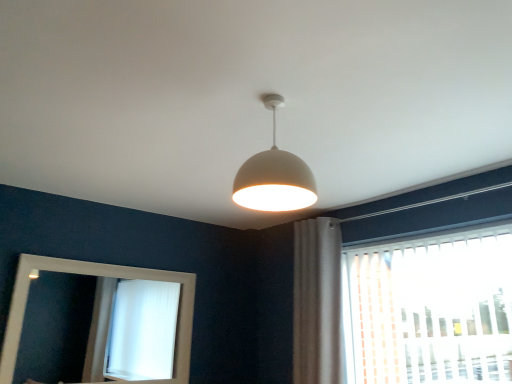
Question: Is white matte/porcelain lampshade at center inside white plastic blinds at right?

Choices:
 (A) no
 (B) yes

Answer: (A)

Question: Is white plastic blinds at right closer to camera compared to white matte/porcelain lampshade at center?

Choices:
 (A) no
 (B) yes

Answer: (A)

Question: Considering the relative sizes of white plastic blinds at right and white matte/porcelain lampshade at center in the image provided, is white plastic blinds at right thinner than white matte/porcelain lampshade at center?

Choices:
 (A) no
 (B) yes

Answer: (B)

Question: Is white plastic blinds at right far away from white matte/porcelain lampshade at center?

Choices:
 (A) yes
 (B) no

Answer: (A)

Question: Is white plastic blinds at right directly adjacent to white matte/porcelain lampshade at center?

Choices:
 (A) yes
 (B) no

Answer: (B)

Question: Can you confirm if white plastic blinds at right is bigger than white matte/porcelain lampshade at center?

Choices:
 (A) no
 (B) yes

Answer: (B)

Question: Does white fabric curtain at right lie in front of white matte/porcelain lampshade at center?

Choices:
 (A) yes
 (B) no

Answer: (B)

Question: From the image's perspective, is white fabric curtain at right above white matte/porcelain lampshade at center?

Choices:
 (A) yes
 (B) no

Answer: (B)

Question: Is white matte/porcelain lampshade at center surrounded by white fabric curtain at right?

Choices:
 (A) yes
 (B) no

Answer: (B)

Question: Is white fabric curtain at right not inside white matte/porcelain lampshade at center?

Choices:
 (A) no
 (B) yes

Answer: (B)

Question: Does white fabric curtain at right have a greater width compared to white matte/porcelain lampshade at center?

Choices:
 (A) no
 (B) yes

Answer: (A)

Question: From a real-world perspective, is white fabric curtain at right located beneath white matte/porcelain lampshade at center?

Choices:
 (A) no
 (B) yes

Answer: (B)

Question: From the image's perspective, is white wooden mirror at lower left under white matte/porcelain lampshade at center?

Choices:
 (A) no
 (B) yes

Answer: (B)